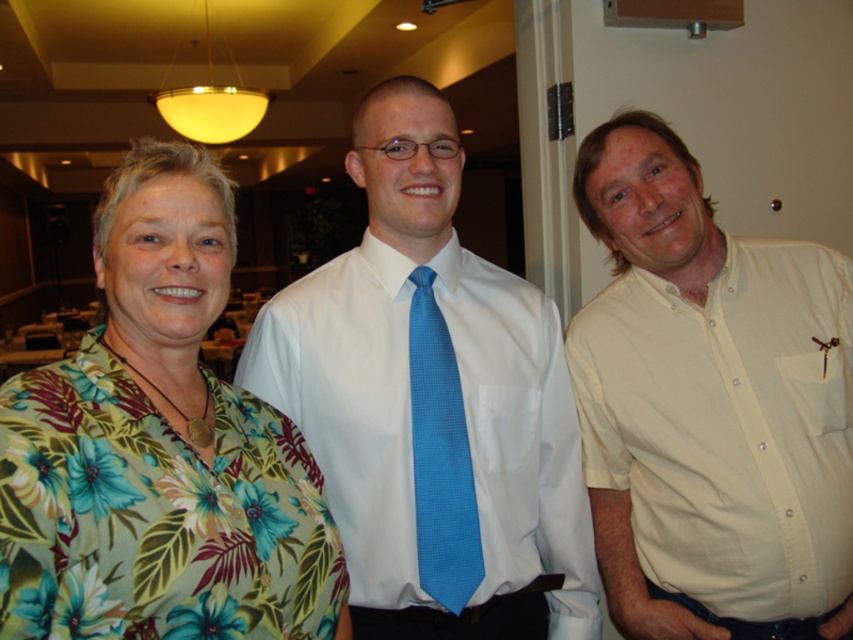
Question: Which object is the farthest from the white smooth shirt at center?

Choices:
 (A) floral print blouse at left
 (B) yellow cotton shirt at right
 (C) blue silk tie at center

Answer: (A)

Question: Is yellow cotton shirt at right below floral print blouse at left?

Choices:
 (A) yes
 (B) no

Answer: (A)

Question: Does floral print blouse at left have a greater width compared to blue silk tie at center?

Choices:
 (A) yes
 (B) no

Answer: (A)

Question: Which point is closer to the camera?

Choices:
 (A) (703, 243)
 (B) (416, 451)

Answer: (B)

Question: Which point is farther to the camera?

Choices:
 (A) blue silk tie at center
 (B) white smooth shirt at center
 (C) yellow cotton shirt at right
 (D) floral print blouse at left

Answer: (C)

Question: Is yellow cotton shirt at right closer to the viewer compared to blue silk tie at center?

Choices:
 (A) yes
 (B) no

Answer: (B)